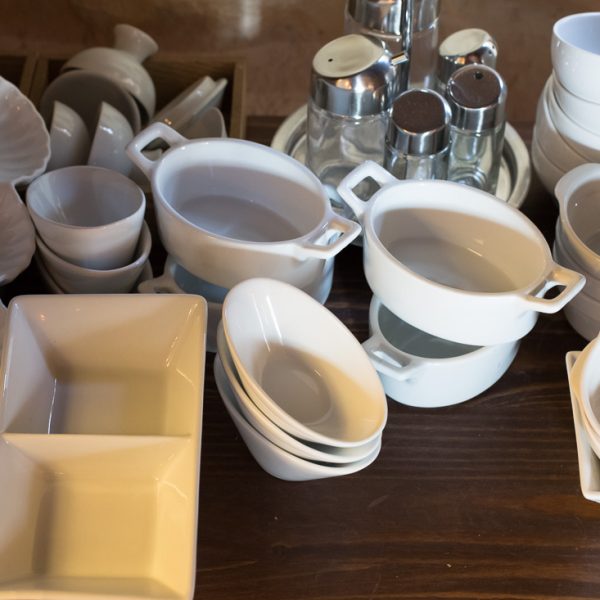
At what (x,y) coordinates should I click in order to perform the action: click on wood surfaces. Please return your answer as a coordinate pair (x, y). Image resolution: width=600 pixels, height=600 pixels. Looking at the image, I should click on (430, 477), (241, 86), (181, 59), (19, 54), (39, 74).